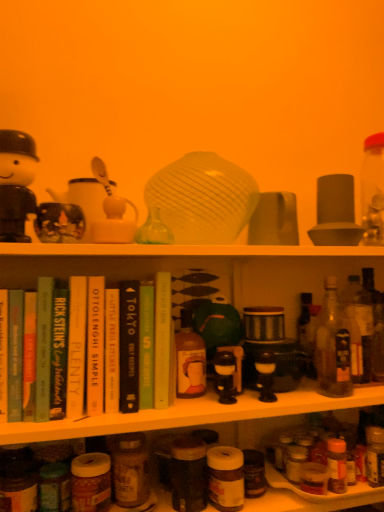
The width and height of the screenshot is (384, 512). I want to click on free space in front of green matte book at center, the 4th book viewed from the left, so click(x=135, y=415).